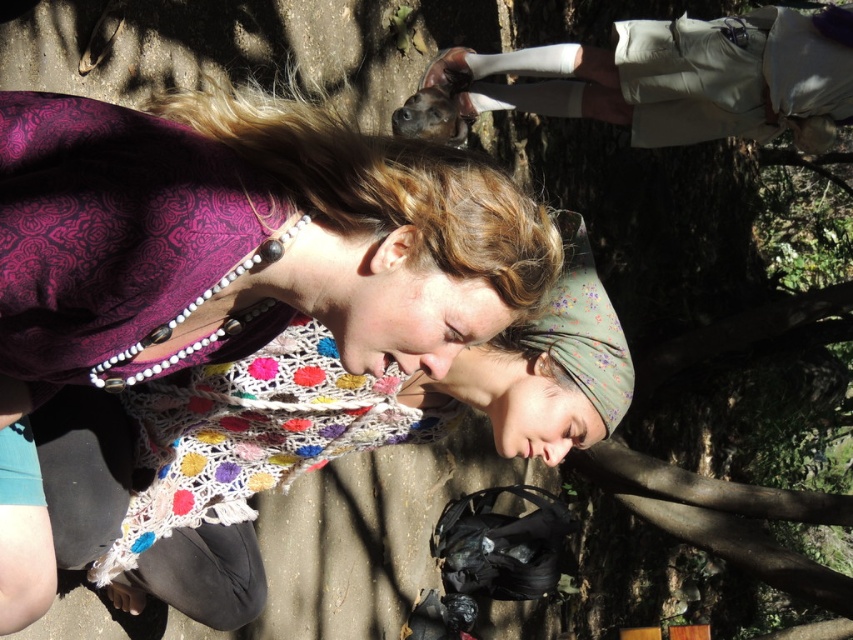
Is multicolored crochet scarf at center bigger than light beige shorts at upper right?

Indeed, multicolored crochet scarf at center has a larger size compared to light beige shorts at upper right.

Can you confirm if multicolored crochet scarf at center is wider than light beige shorts at upper right?

No, multicolored crochet scarf at center is not wider than light beige shorts at upper right.

Who is more distant from viewer, (210, 448) or (728, 74)?

Positioned behind is point (728, 74).

Where is `multicolored crochet scarf at center`? The image size is (853, 640). multicolored crochet scarf at center is located at coordinates (300, 440).